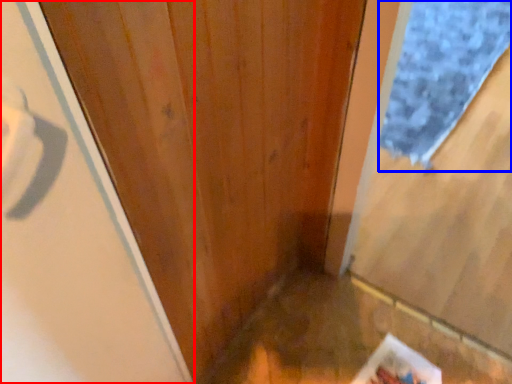
Question: Among these objects, which one is farthest to the camera, screen door (highlighted by a red box) or doormat (highlighted by a blue box)?

Choices:
 (A) screen door
 (B) doormat

Answer: (B)